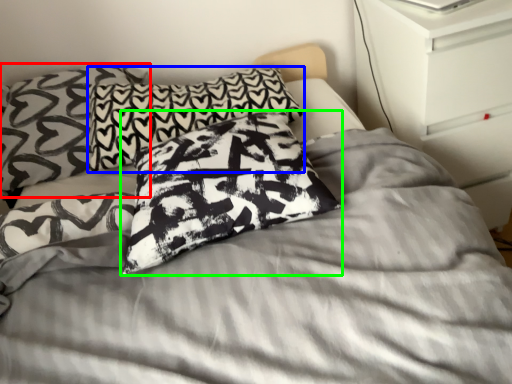
Question: Estimate the real-world distances between objects in this image. Which object is closer to pillow (highlighted by a red box), pillow (highlighted by a blue box) or pillow (highlighted by a green box)?

Choices:
 (A) pillow
 (B) pillow

Answer: (A)